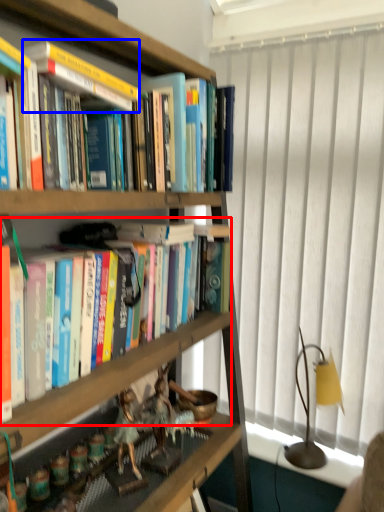
Question: Among these objects, which one is nearest to the camera, book (highlighted by a red box) or paperback book (highlighted by a blue box)?

Choices:
 (A) book
 (B) paperback book

Answer: (A)